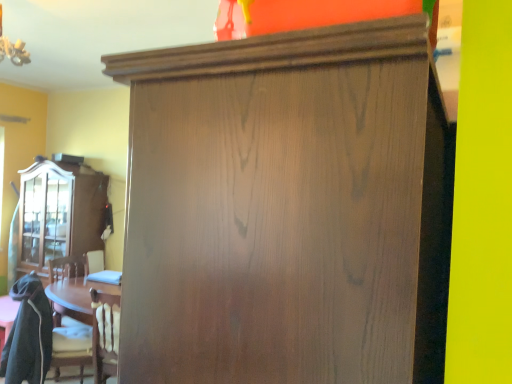
Question: Does satin wood cupboard at center appear on the right side of matte wood cabinet at left?

Choices:
 (A) yes
 (B) no

Answer: (A)

Question: Can matte wood cabinet at left be found inside satin wood cupboard at center?

Choices:
 (A) no
 (B) yes

Answer: (A)

Question: Is satin wood cupboard at center wider than matte wood cabinet at left?

Choices:
 (A) yes
 (B) no

Answer: (A)

Question: Is satin wood cupboard at center positioned behind matte wood cabinet at left?

Choices:
 (A) yes
 (B) no

Answer: (B)

Question: Is satin wood cupboard at center with matte wood cabinet at left?

Choices:
 (A) no
 (B) yes

Answer: (A)

Question: From the image's perspective, is satin wood cupboard at center on matte wood cabinet at left?

Choices:
 (A) yes
 (B) no

Answer: (B)

Question: Considering the relative sizes of wooden swivel chair at lower left and satin wood cupboard at center in the image provided, is wooden swivel chair at lower left bigger than satin wood cupboard at center?

Choices:
 (A) yes
 (B) no

Answer: (B)

Question: Is wooden swivel chair at lower left aimed at satin wood cupboard at center?

Choices:
 (A) no
 (B) yes

Answer: (A)

Question: Is wooden swivel chair at lower left to the left of satin wood cupboard at center from the viewer's perspective?

Choices:
 (A) yes
 (B) no

Answer: (A)

Question: Considering the relative sizes of wooden swivel chair at lower left and satin wood cupboard at center in the image provided, is wooden swivel chair at lower left thinner than satin wood cupboard at center?

Choices:
 (A) no
 (B) yes

Answer: (A)

Question: Would you say wooden swivel chair at lower left is outside satin wood cupboard at center?

Choices:
 (A) yes
 (B) no

Answer: (A)

Question: From a real-world perspective, is wooden swivel chair at lower left located beneath satin wood cupboard at center?

Choices:
 (A) yes
 (B) no

Answer: (A)

Question: Does matte wood cabinet at left have a greater width compared to wooden swivel chair at lower left?

Choices:
 (A) no
 (B) yes

Answer: (A)